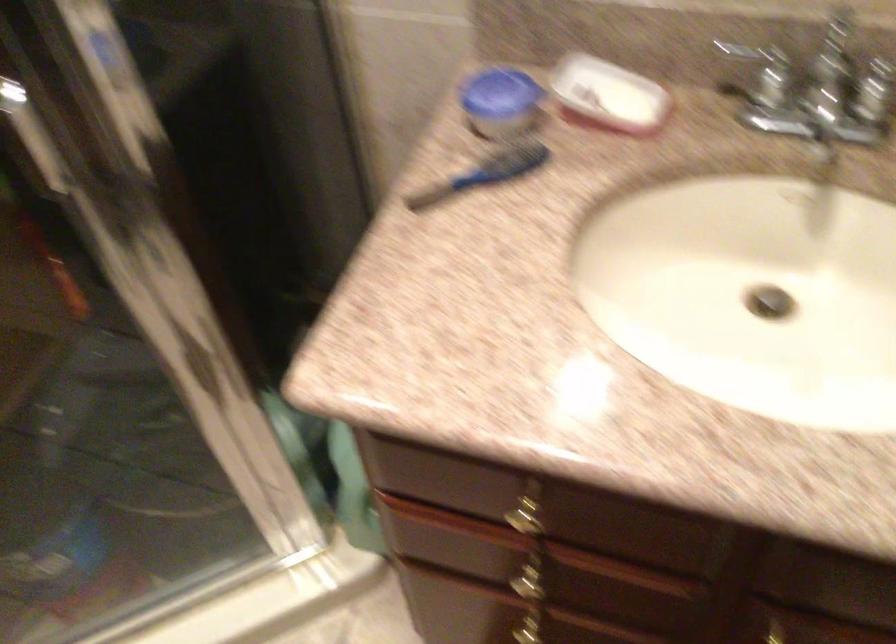
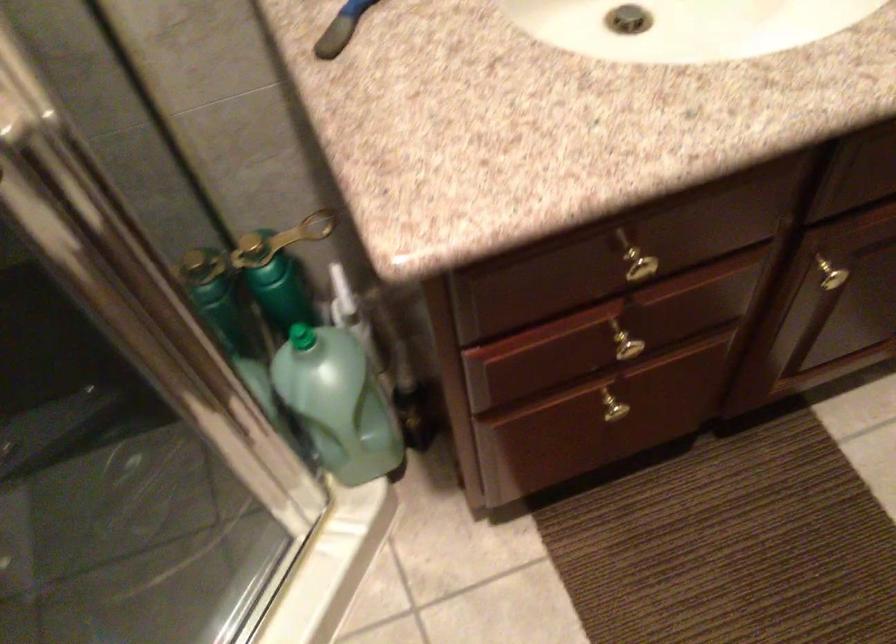
Locate, in the second image, the point that corresponds to the point at 440,194 in the first image.

(340, 29)